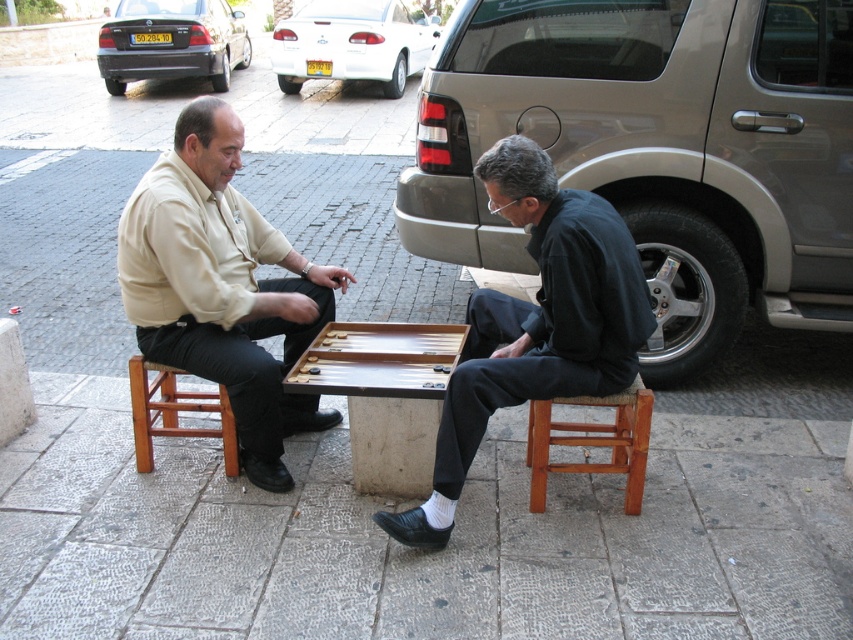
In the scene shown: You are a photographer standing 10 feet away from the beige cotton shirt at left and dark blue fabric shirt at center. Can you fit both subjects in your camera frame if your camera has a maximum horizontal field of view of 30 inches?

The distance between the beige cotton shirt at left and dark blue fabric shirt at center is 33.50 inches. Since the camera has a maximum horizontal field of view of 30 inches, the photographer cannot fit both subjects in the frame as the distance exceeds the camera capability.

You are standing in the scene and want to place a small vase between the two men without blocking their view of the backgammon board. The vase requires a space of 0.5 meters in front of it to avoid obstruction. Can you place the vase at point (177,362)?

The point (177,362) is 2.85 meters away from the viewer. Since the vase requires 0.5 meters in front, there is sufficient space to place it there without blocking their view.